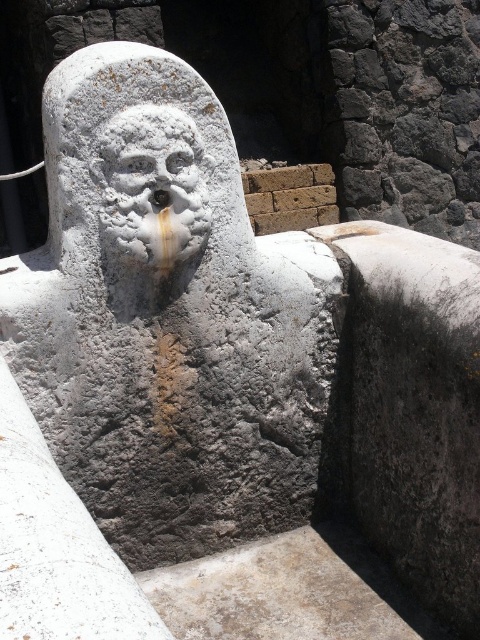
Question: Which point is farther to the camera?

Choices:
 (A) (180, 170)
 (B) (100, 195)

Answer: (A)

Question: Does white stone head at center have a smaller size compared to white stone face at center?

Choices:
 (A) yes
 (B) no

Answer: (B)

Question: Can you confirm if white stone head at center is positioned below white stone face at center?

Choices:
 (A) no
 (B) yes

Answer: (A)

Question: Is white stone head at center bigger than white stone face at center?

Choices:
 (A) no
 (B) yes

Answer: (B)